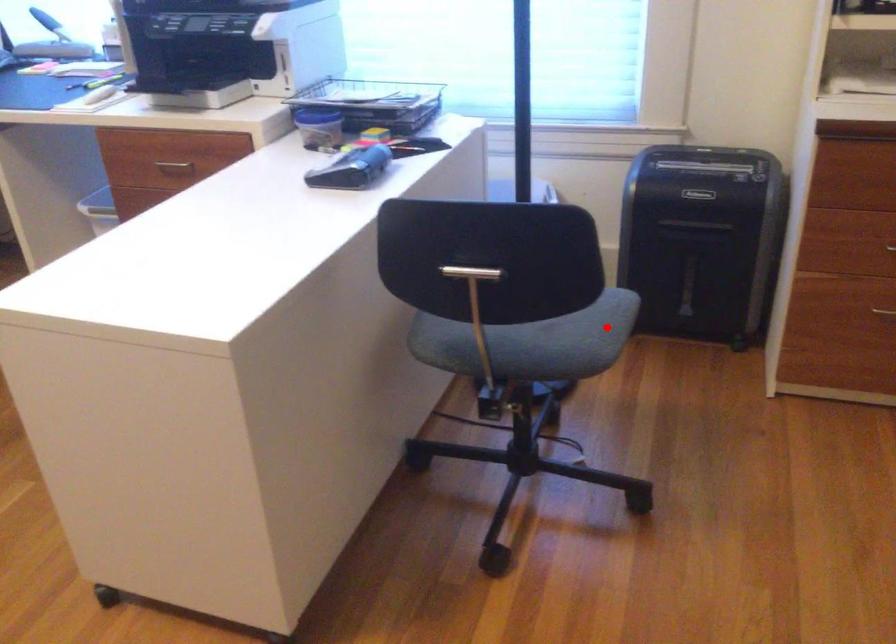
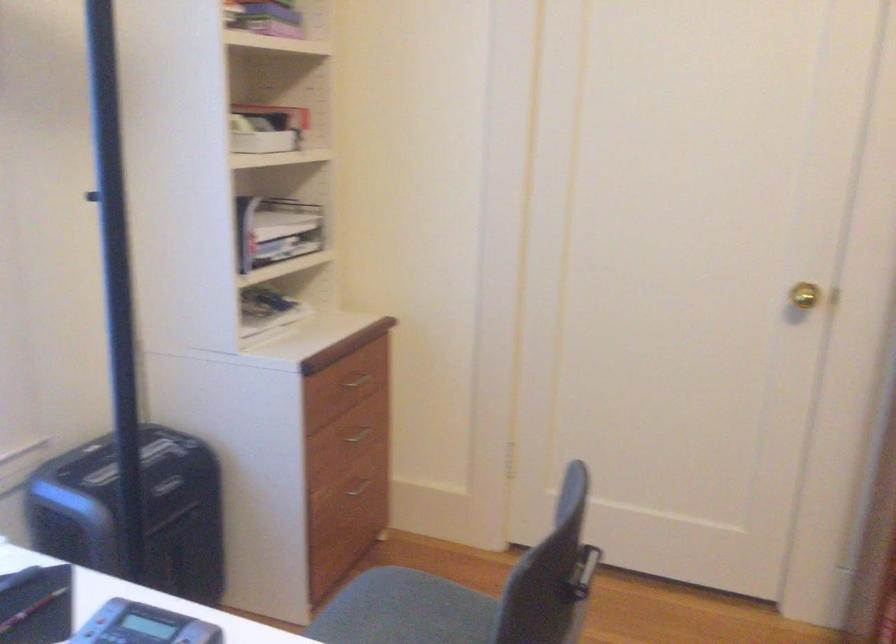
In the second image, find the point that corresponds to the highlighted location in the first image.

(405, 611)